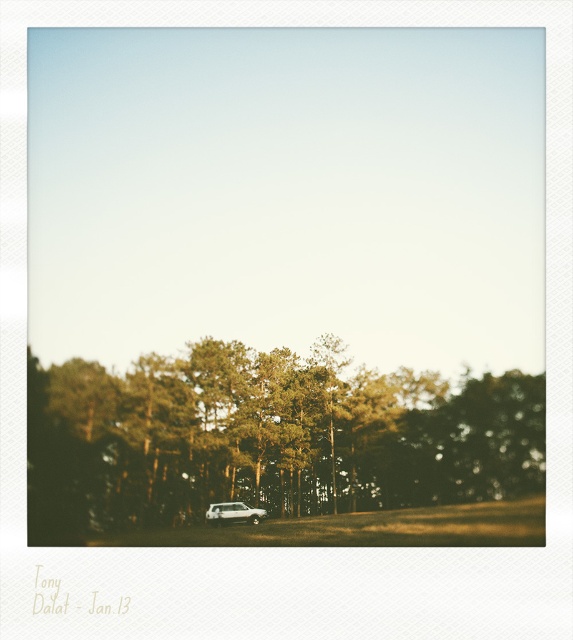
Can you confirm if green matte tree at center is shorter than white matte suv at center?

In fact, green matte tree at center may be taller than white matte suv at center.

Does point (179, 515) come closer to viewer compared to point (222, 506)?

No, (179, 515) is behind (222, 506).

Locate an element on the screen. This screenshot has height=640, width=573. green matte tree at center is located at coordinates (266, 438).